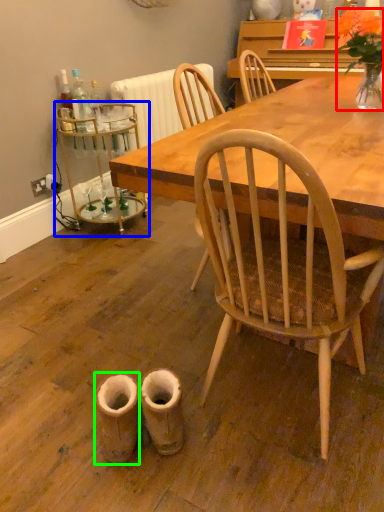
Question: Based on their relative distances, which object is farther from houseplant (highlighted by a red box)? Choose from side table (highlighted by a blue box) and walking shoe (highlighted by a green box).

Choices:
 (A) side table
 (B) walking shoe

Answer: (B)